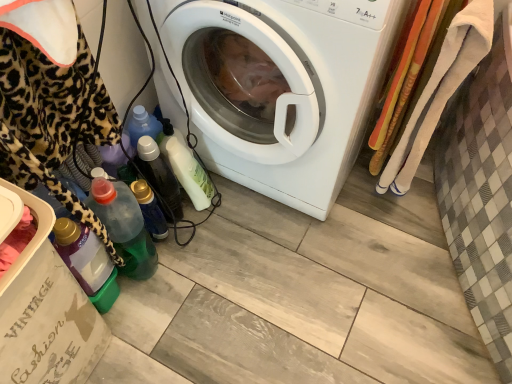
Question: From a real-world perspective, is green translucent bottle at lower left, arranged as the first bottle when viewed from the left, physically located above or below matte cardboard box at lower left?

Choices:
 (A) below
 (B) above

Answer: (A)

Question: Would you say green translucent bottle at lower left, arranged as the first bottle when viewed from the left, is inside or outside matte cardboard box at lower left?

Choices:
 (A) inside
 (B) outside

Answer: (B)

Question: Estimate the real-world distances between objects in this image. Which object is closer to the translucent plastic bottle at lower left, the 2th bottle when ordered from right to left?

Choices:
 (A) green translucent bottle at lower left, arranged as the first bottle when viewed from the left
 (B) translucent plastic bottle at lower left, the second bottle positioned from the left
 (C) white glossy washing machine at center
 (D) translucent plastic bottle at lower left, arranged as the 3th bottle when viewed from the right
 (E) matte cardboard box at lower left

Answer: (D)

Question: Estimate the real-world distances between objects in this image. Which object is farther from the translucent plastic bottle at lower left, arranged as the 3th bottle when viewed from the right?

Choices:
 (A) translucent plastic bottle at lower center, placed as the 1th bottle when sorted from right to left
 (B) matte cardboard box at lower left
 (C) translucent plastic bottle at lower left, the fourth bottle from the right
 (D) white glossy washing machine at center
 (E) translucent plastic bottle at lower left, the 2th bottle when ordered from right to left

Answer: (D)